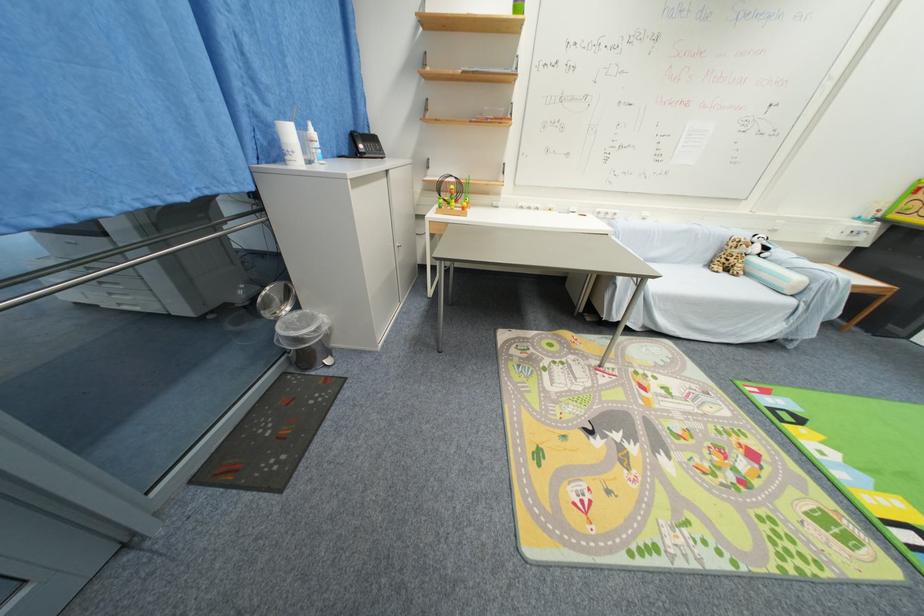
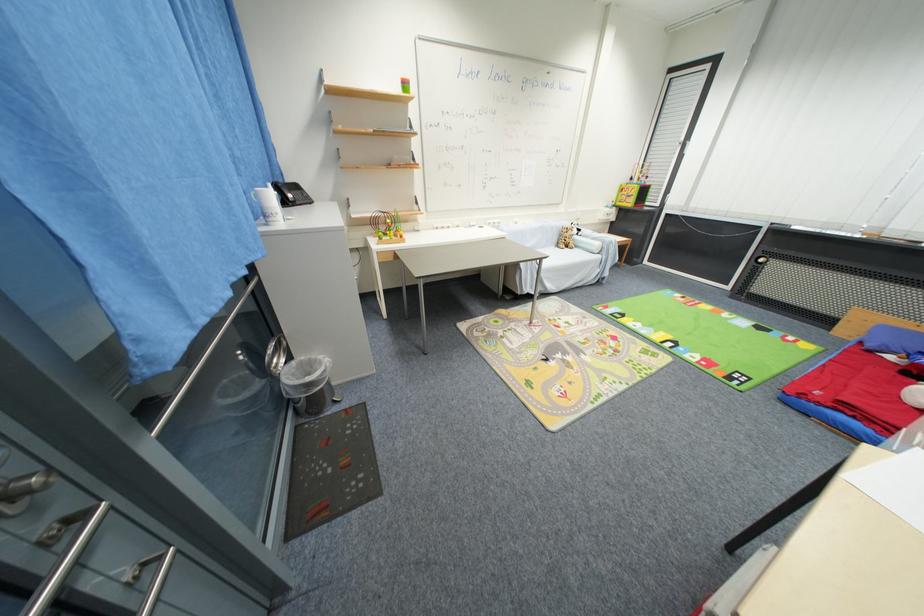
Locate, in the second image, the point that corresponds to (445,209) in the first image.

(385, 241)